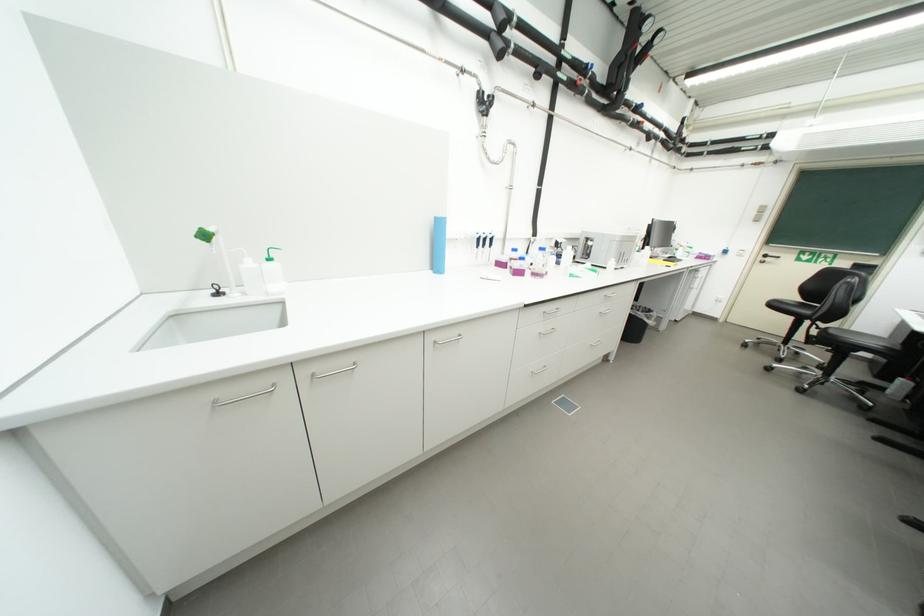
Where would you push the door handle? Please return your answer as a coordinate pair (x, y).

(242, 397)